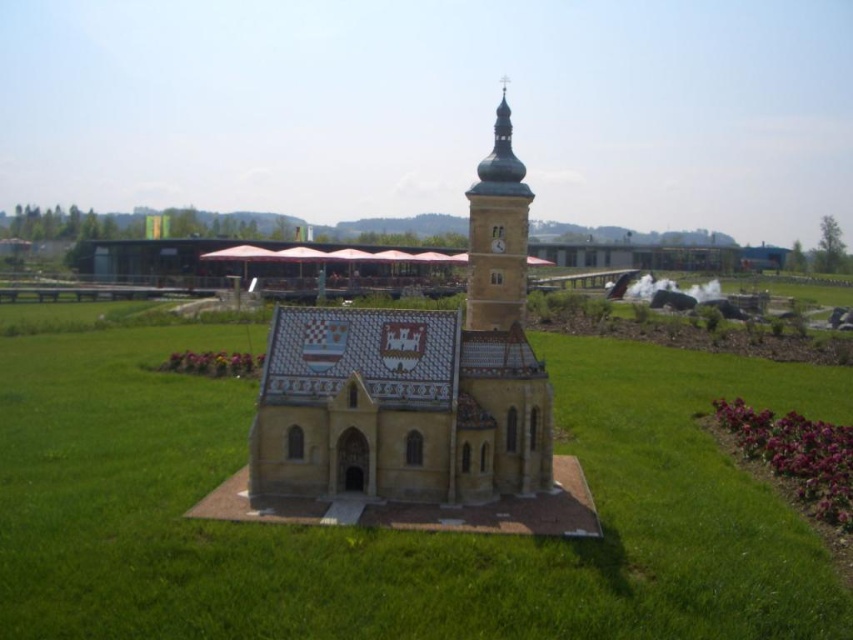
Does checkered tile church at center have a lesser height compared to multicolored mosaic church at center?

Yes, checkered tile church at center is shorter than multicolored mosaic church at center.

Does checkered tile church at center lie behind multicolored mosaic church at center?

No, checkered tile church at center is closer to the viewer.

Find the location of a particular element. The image size is (853, 640). checkered tile church at center is located at coordinates (389, 531).

Which is more to the right, multicolored mosaic church at center or brown stone clock tower at upper center?

brown stone clock tower at upper center

Does multicolored mosaic church at center appear on the right side of brown stone clock tower at upper center?

In fact, multicolored mosaic church at center is to the left of brown stone clock tower at upper center.

What do you see at coordinates (415, 380) in the screenshot? I see `multicolored mosaic church at center` at bounding box center [415, 380].

The width and height of the screenshot is (853, 640). I want to click on multicolored mosaic church at center, so click(x=415, y=380).

Which is more to the right, checkered tile church at center or brown stone clock tower at upper center?

From the viewer's perspective, brown stone clock tower at upper center appears more on the right side.

I want to click on checkered tile church at center, so click(389, 531).